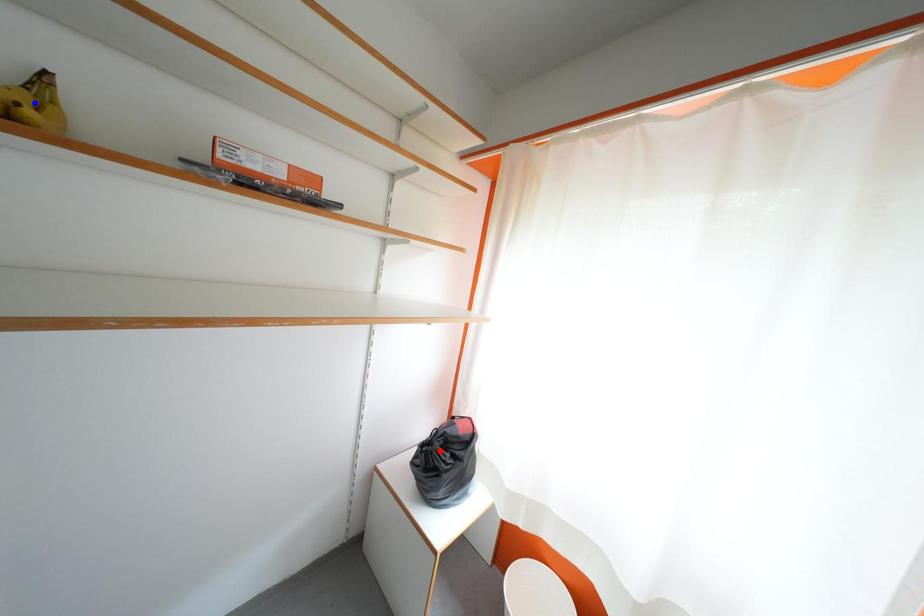
Question: Which of the two points in the image is closer to the camera?

Choices:
 (A) Blue point is closer.
 (B) Red point is closer.

Answer: (A)